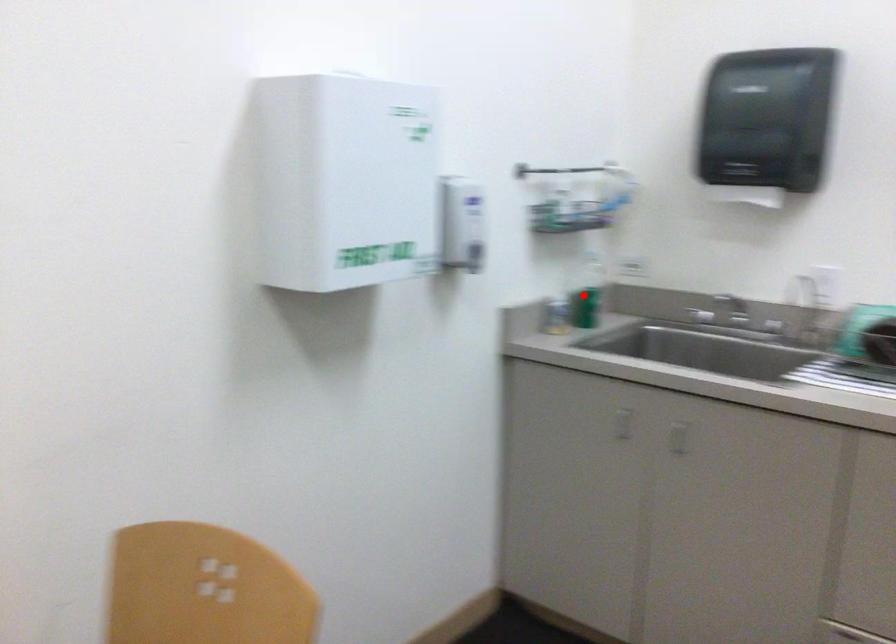
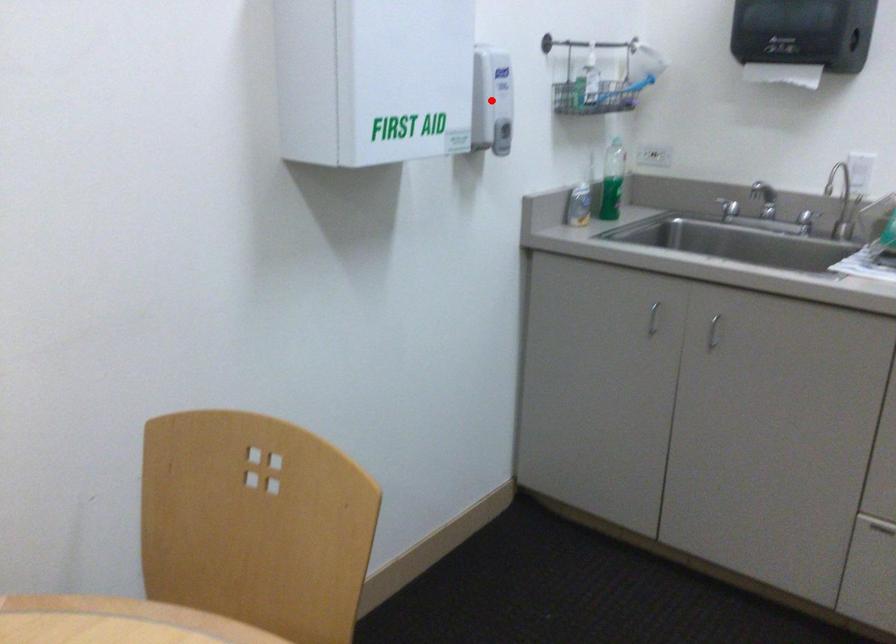
I am providing you with two images of the same scene from different viewpoints. A red point is marked on the first image and another point is marked on the second image. Is the red point in image1 aligned with the point shown in image2?

No